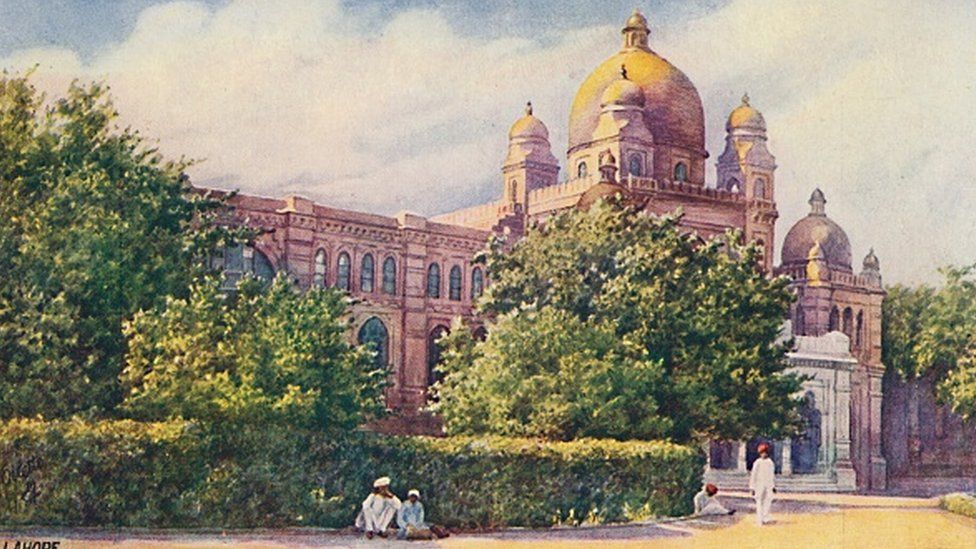
Identify the location of arched doorways. This screenshot has width=976, height=549. (804, 428), (771, 429), (724, 431).